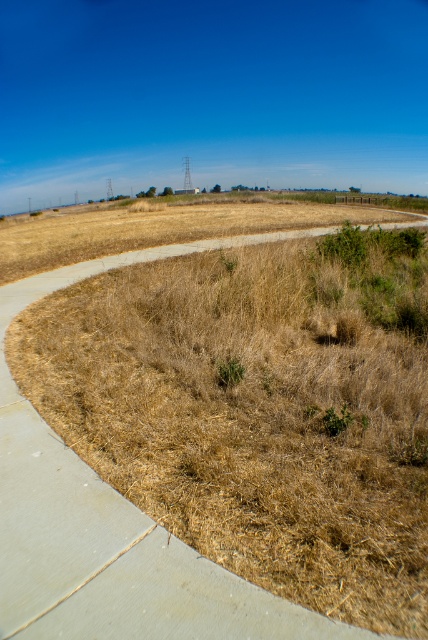
Question: Does brown dry grass at center appear on the right side of green leafy weed at center?

Choices:
 (A) yes
 (B) no

Answer: (B)

Question: Can you confirm if brown dry grass at center is thinner than green leafy weed at center?

Choices:
 (A) no
 (B) yes

Answer: (A)

Question: Is the position of brown dry grass at center less distant than that of green leafy weed at center?

Choices:
 (A) yes
 (B) no

Answer: (A)

Question: Which of the following is the farthest from the observer?

Choices:
 (A) (281, 625)
 (B) (231, 387)

Answer: (B)